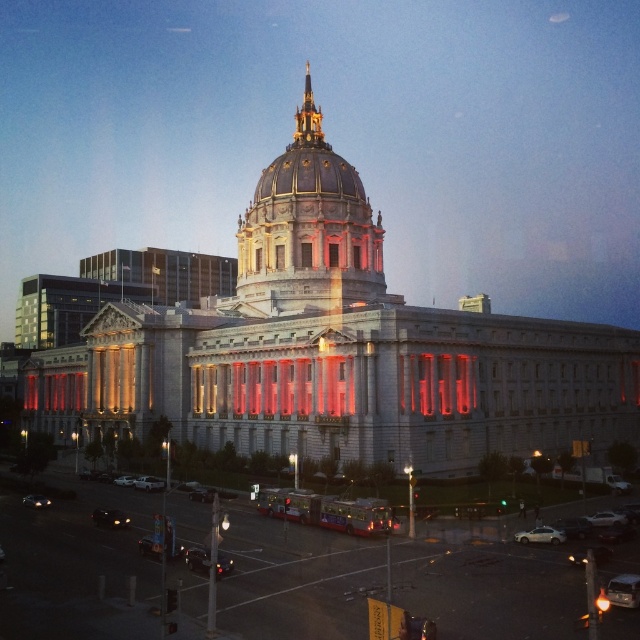
Question: Which object is closer to the camera taking this photo?

Choices:
 (A) shiny black car at lower left
 (B) silver metallic car at lower right
 (C) shiny black sedan at lower left
 (D) silver metallic sedan at center

Answer: (B)

Question: Where is shiny black sedan at center located in relation to silver metallic car at lower right in the image?

Choices:
 (A) below
 (B) above

Answer: (A)

Question: Is shiny black car at lower left below silver metallic sedan at center?

Choices:
 (A) no
 (B) yes

Answer: (B)

Question: Which point is farther to the camera?

Choices:
 (A) shiny black sedan at center
 (B) shiny black sedan at lower left
 (C) silver metallic car at lower right
 (D) shiny black car at lower left

Answer: (B)

Question: Which is farther from the shiny black car at lower left?

Choices:
 (A) silver metallic car at lower right
 (B) silver metallic sedan at center
 (C) shiny black sedan at center
 (D) shiny black sedan at lower left

Answer: (A)

Question: Can you confirm if shiny black sedan at center is bigger than silver metallic car at lower right?

Choices:
 (A) yes
 (B) no

Answer: (B)